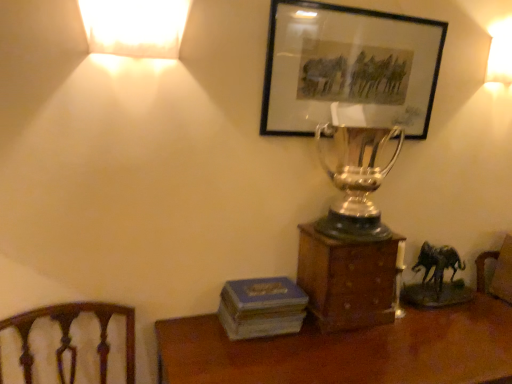
What are the coordinates of `unoccupied region to the right of blue matte book at lower center` in the screenshot? It's located at tap(328, 345).